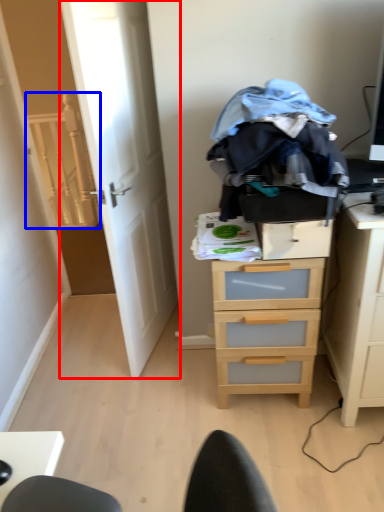
Question: Among these objects, which one is nearest to the camera, door (highlighted by a red box) or stairwell (highlighted by a blue box)?

Choices:
 (A) door
 (B) stairwell

Answer: (A)